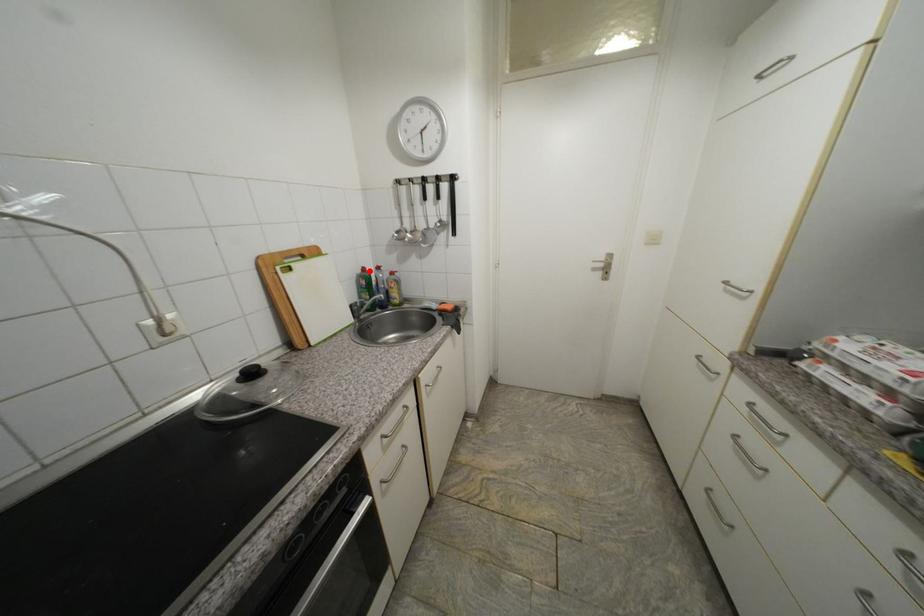
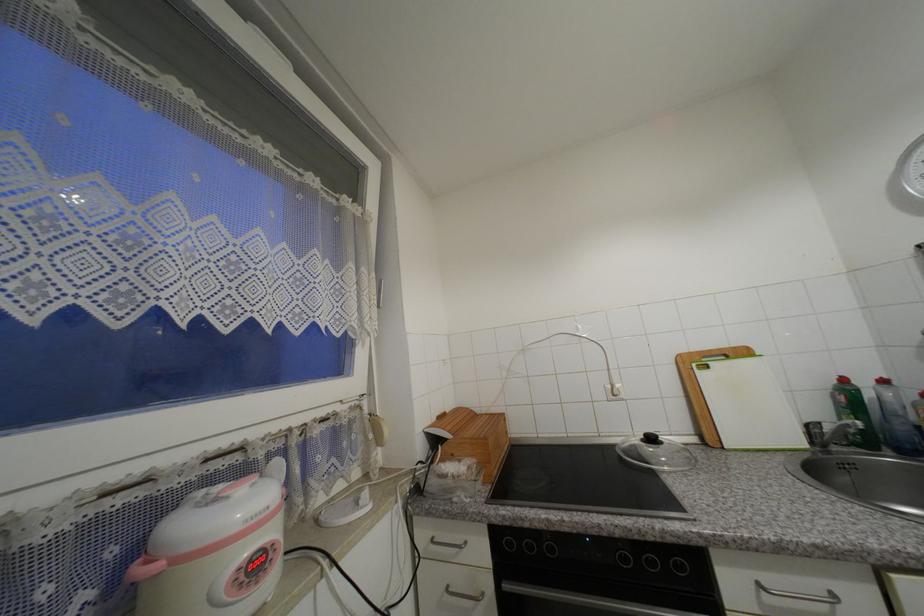
Find the pixel in the second image that matches the highlighted location in the first image.

(849, 381)